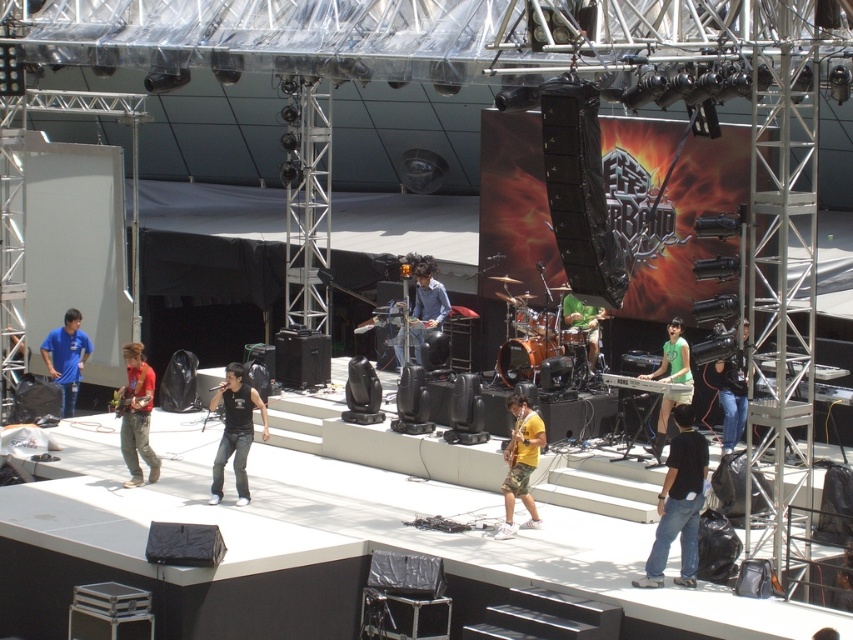
You are a photographer at the concert and want to capture a shot of the black cotton shirt at center and the green matte keyboard at center. Based on their positions, which object should you focus on first to ensure both are in frame?

The black cotton shirt at center is located below the green matte keyboard at center, so you should focus on the green matte keyboard at center first to ensure both are in frame.

You are a photographer at the concert and want to ensure both the black leather pants at center and the yellow matte shirt at center are fully visible in your photo. Which one might require you to adjust your camera angle to capture the full length?

The black leather pants at center is shorter than the yellow matte shirt at center, so you might need to adjust your camera angle to ensure the yellow matte shirt at center is fully captured since it is taller.